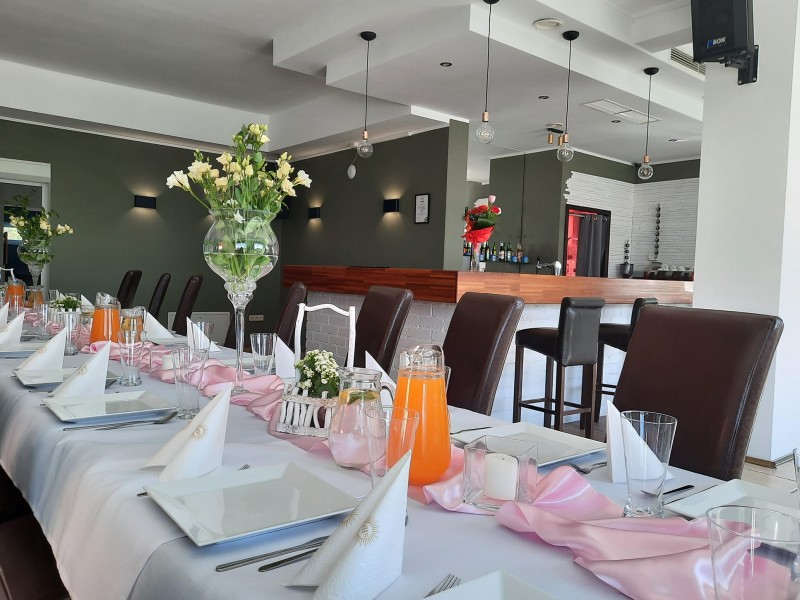
The image size is (800, 600). Identify the location of backs of all chairs. (692, 380), (466, 326), (380, 310), (274, 308), (184, 297), (150, 283), (116, 283), (574, 325), (648, 301).